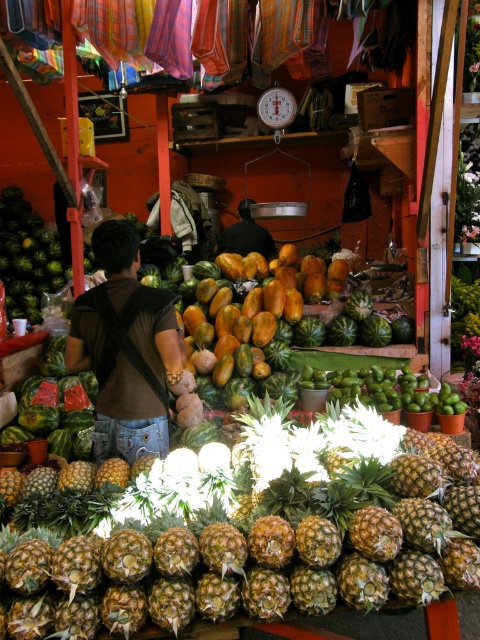
You are a vendor at the market and need to place a new item between the green rough pineapple at center and the black fabric at center. Which object should you move to create space?

The green rough pineapple at center might be wider than the black fabric at center, so you should move the green rough pineapple at center to create space.

From the picture: You are a customer at the market and want to pick up the item closest to you. Which of the two points, point (362, 552) or point (248, 216), should you approach?

Point (362, 552) is closer to the camera than point (248, 216), so you should approach point (362, 552) to pick up the item closest to you.